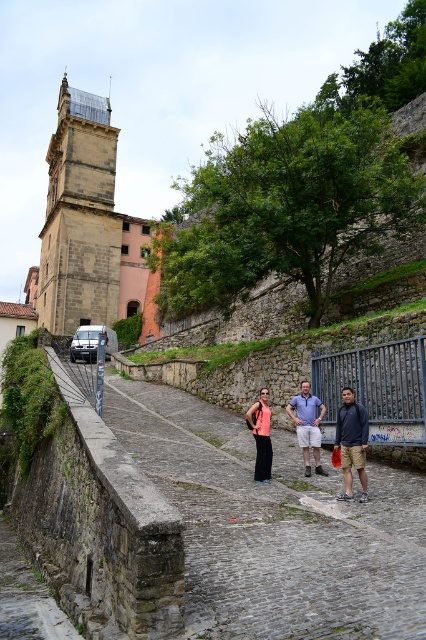
Question: Does matte orange tank top at center appear on the left side of matte coral top at center?

Choices:
 (A) no
 (B) yes

Answer: (A)

Question: Considering the relative positions of cobblestone path at center and matte orange tank top at center in the image provided, where is cobblestone path at center located with respect to matte orange tank top at center?

Choices:
 (A) left
 (B) right

Answer: (A)

Question: Is cobblestone path at center to the right of dark blue hoodie at center from the viewer's perspective?

Choices:
 (A) yes
 (B) no

Answer: (B)

Question: Which point is closer to the camera?

Choices:
 (A) (302, 413)
 (B) (252, 406)

Answer: (A)

Question: Which of the following is the farthest from the observer?

Choices:
 (A) (313, 424)
 (B) (359, 472)

Answer: (A)

Question: Which object is the farthest from the brown stone tower at upper left?

Choices:
 (A) matte coral top at center
 (B) light blue denim shorts at center

Answer: (A)